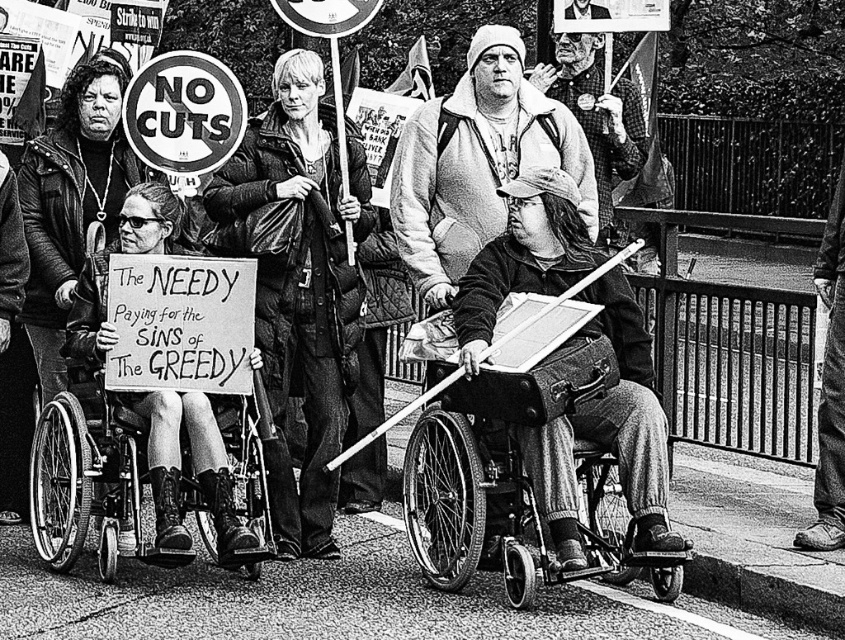
Based on the scene description, can you determine which object is closer to the observer between the metallic wheelchair at lower left and the checkered flannel shirt at center?

The metallic wheelchair at lower left is in front of the checkered flannel shirt at center, so it is closer to the observer.

You are a photographer trying to capture a closeup shot of both the black plastic wheelchair at center and the matte black wheelchair at left. Given that your camera can focus on objects within a 5 feet range, is it possible to photograph both wheelchairs without moving either of them?

The black plastic wheelchair at center is 6.78 feet away from the matte black wheelchair at left. Since the distance between them exceeds the camera focus range of 5 feet, you cannot photograph both wheelchairs simultaneously without moving them.

You are a photographer analyzing this protest photo. You need to determine if the metallic wheelchair at lower left can fit through a doorway that is the same width as the white cotton hoodie at center. Based on their sizes, what would you conclude?

The metallic wheelchair at lower left is smaller than the white cotton hoodie at center. Since the doorway is the same width as the white cotton hoodie at center, the metallic wheelchair at lower left can fit through the doorway.